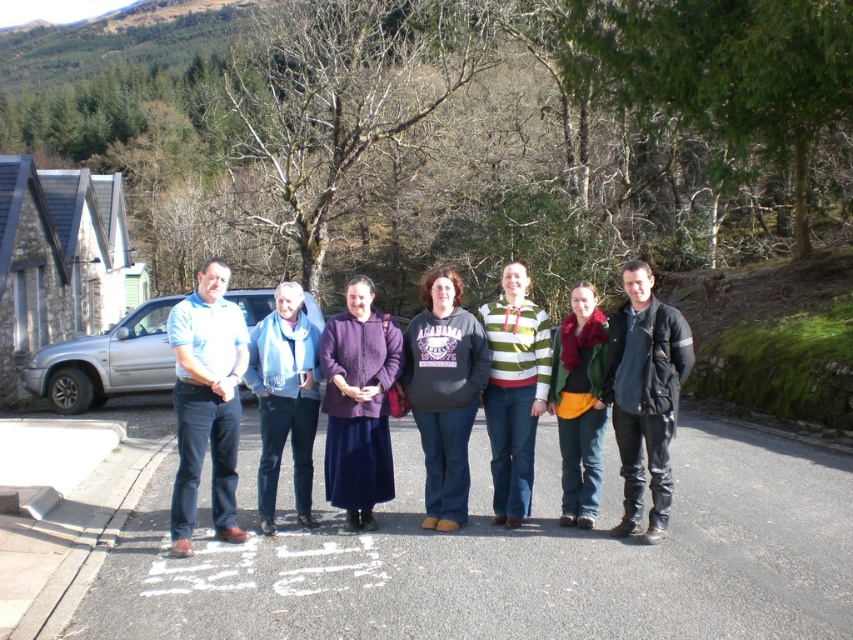
Question: Can you confirm if dark gray sweater at center is thinner than striped sweater at center?

Choices:
 (A) no
 (B) yes

Answer: (B)

Question: Which object appears farthest from the camera in this image?

Choices:
 (A) dark gray sweater at center
 (B) green woolen sweater at center

Answer: (A)

Question: Can you confirm if blue scarf at center is positioned above green woolen sweater at center?

Choices:
 (A) no
 (B) yes

Answer: (A)

Question: Which object is farther from the camera taking this photo?

Choices:
 (A) silver metallic car at left
 (B) blue scarf at center

Answer: (A)

Question: Which point is farther from the camera taking this photo?

Choices:
 (A) (440, 417)
 (B) (625, 374)
 (C) (299, 452)

Answer: (C)

Question: Is black leather jacket at center wider than dark gray sweater at center?

Choices:
 (A) no
 (B) yes

Answer: (B)